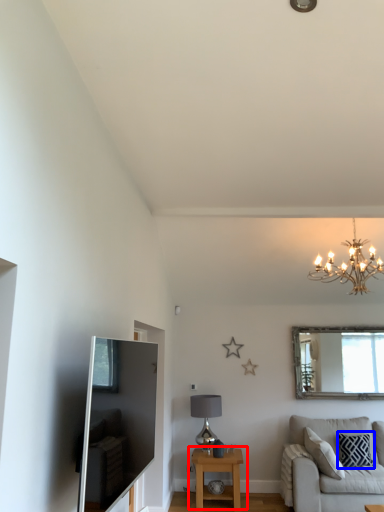
Question: Which object is closer to the camera taking this photo, table (highlighted by a red box) or pillow (highlighted by a blue box)?

Choices:
 (A) table
 (B) pillow

Answer: (A)